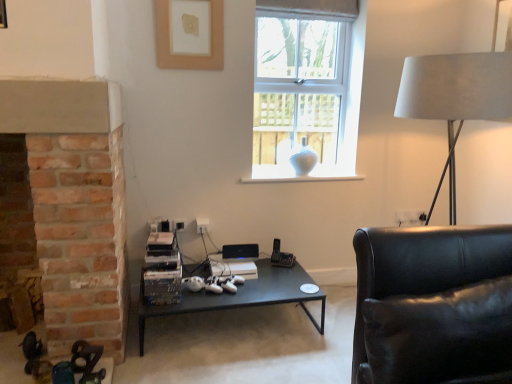
The image size is (512, 384). What do you see at coordinates (188, 35) in the screenshot?
I see `matte white picture frame at upper center` at bounding box center [188, 35].

This screenshot has height=384, width=512. What are the coordinates of `black matte coffee table at center` in the screenshot? It's located at (241, 296).

Describe the element at coordinates (456, 94) in the screenshot. I see `white fabric lampshade at right` at that location.

Where is `black leather couch at right`? This screenshot has height=384, width=512. black leather couch at right is located at coordinates (433, 305).

Looking at this image, is white fabric lampshade at right positioned in front of white glossy vase at center?

Yes, it is in front of white glossy vase at center.

Is white fabric lampshade at right next to white glossy vase at center?

They are not placed beside each other.

Does white fabric lampshade at right have a larger size compared to white glossy vase at center?

Yes, white fabric lampshade at right is bigger than white glossy vase at center.

Consider the image. Is matte white picture frame at upper center positioned before black matte coffee table at center?

No, matte white picture frame at upper center is further to the viewer.

From a real-world perspective, is matte white picture frame at upper center located beneath black matte coffee table at center?

Incorrect, from a real-world perspective, matte white picture frame at upper center is higher than black matte coffee table at center.

Considering the relative positions of matte white picture frame at upper center and black matte coffee table at center in the image provided, is matte white picture frame at upper center to the left or to the right of black matte coffee table at center?

In the image, matte white picture frame at upper center appears on the left side of black matte coffee table at center.

Is black matte coffee table at center smaller than black leather couch at right?

Yes, black matte coffee table at center is smaller than black leather couch at right.

Is black matte coffee table at center next to black leather couch at right and touching it?

There is a gap between black matte coffee table at center and black leather couch at right.

Considering the sizes of objects black matte coffee table at center and black leather couch at right in the image provided, who is wider, black matte coffee table at center or black leather couch at right?

Wider between the two is black leather couch at right.

Considering the positions of objects matte white picture frame at upper center and black leather couch at right in the image provided, who is in front, matte white picture frame at upper center or black leather couch at right?

Positioned in front is black leather couch at right.

Is matte white picture frame at upper center positioned beyond the bounds of black leather couch at right?

Yes.

From a real-world perspective, between matte white picture frame at upper center and black leather couch at right, who is vertically lower?

black leather couch at right.

How far apart are white fabric lampshade at right and matte white picture frame at upper center?

white fabric lampshade at right and matte white picture frame at upper center are 4.22 feet apart from each other.

From the image's perspective, between white fabric lampshade at right and matte white picture frame at upper center, who is located below?

white fabric lampshade at right.

Does white fabric lampshade at right turn towards matte white picture frame at upper center?

No, white fabric lampshade at right does not turn towards matte white picture frame at upper center.

From a real-world perspective, is white fabric lampshade at right below matte white picture frame at upper center?

Answer: Yes, from a real-world perspective, white fabric lampshade at right is under matte white picture frame at upper center.

Which is more to the right, white glossy vase at center or black matte coffee table at center?

From the viewer's perspective, white glossy vase at center appears more on the right side.

Which of these two, white glossy vase at center or black matte coffee table at center, stands taller?

black matte coffee table at center.

From the image's perspective, relative to black matte coffee table at center, is white glossy vase at center above or below?

white glossy vase at center is above black matte coffee table at center.

Is white glossy vase at center smaller than black matte coffee table at center?

Indeed, white glossy vase at center has a smaller size compared to black matte coffee table at center.

Is white glass vase at upper center oriented towards black leather couch at right?

Yes, white glass vase at upper center faces towards black leather couch at right.

At what (x,y) coordinates should I click in order to perform the action: click on studio couch located on the right of white glass vase at upper center. Please return your answer as a coordinate pair (x, y). This screenshot has height=384, width=512. Looking at the image, I should click on (433, 305).

Between white glass vase at upper center and black leather couch at right, which one appears on the left side from the viewer's perspective?

white glass vase at upper center.

In the image, there is a white fabric lampshade at right. At what (x,y) coordinates should I click in order to perform the action: click on window sill below it (from the image's perspective). Please return your answer as a coordinate pair (x, y). Looking at the image, I should click on (300, 178).

Locate an element on the screen. The width and height of the screenshot is (512, 384). coffee table that appears in front of the matte white picture frame at upper center is located at coordinates (241, 296).

Considering their positions, is black matte coffee table at center positioned closer to black leather couch at right than white glossy vase at center?

Based on the image, black matte coffee table at center appears to be nearer to black leather couch at right.

Considering their positions, is black matte coffee table at center positioned closer to black leather couch at right than matte white picture frame at upper center?

black matte coffee table at center is closer to black leather couch at right.

When comparing their distances from matte white picture frame at upper center, does white fabric lampshade at right or black matte coffee table at center seem further?

Among the two, black matte coffee table at center is located further to matte white picture frame at upper center.

When comparing their distances from white glass vase at upper center, does white fabric lampshade at right or white glossy vase at center seem further?

Based on the image, white fabric lampshade at right appears to be further to white glass vase at upper center.

Looking at the image, which one is located further to white glossy vase at center, black matte coffee table at center or white fabric lampshade at right?

white fabric lampshade at right is positioned further to the anchor white glossy vase at center.

From the image, which object appears to be nearer to matte white picture frame at upper center, white glass vase at upper center or white glossy vase at center?

white glass vase at upper center is closer to matte white picture frame at upper center.

From the image, which object appears to be nearer to black matte coffee table at center, white fabric lampshade at right or white glossy vase at center?

Among the two, white glossy vase at center is located nearer to black matte coffee table at center.

Based on their spatial positions, is black matte coffee table at center or white fabric lampshade at right closer to matte white picture frame at upper center?

white fabric lampshade at right is closer to matte white picture frame at upper center.

I want to click on table lamp located between black leather couch at right and white glossy vase at center in the depth direction, so click(x=456, y=94).

At what (x,y) coordinates should I click in order to perform the action: click on table lamp between matte white picture frame at upper center and black matte coffee table at center from top to bottom. Please return your answer as a coordinate pair (x, y). Looking at the image, I should click on pyautogui.click(x=456, y=94).

Identify the location of window sill that lies between matte white picture frame at upper center and black matte coffee table at center from top to bottom. (300, 178).

Image resolution: width=512 pixels, height=384 pixels. Find the location of `window between matte white picture frame at upper center and white glossy vase at center from top to bottom`. window between matte white picture frame at upper center and white glossy vase at center from top to bottom is located at coordinates (307, 92).